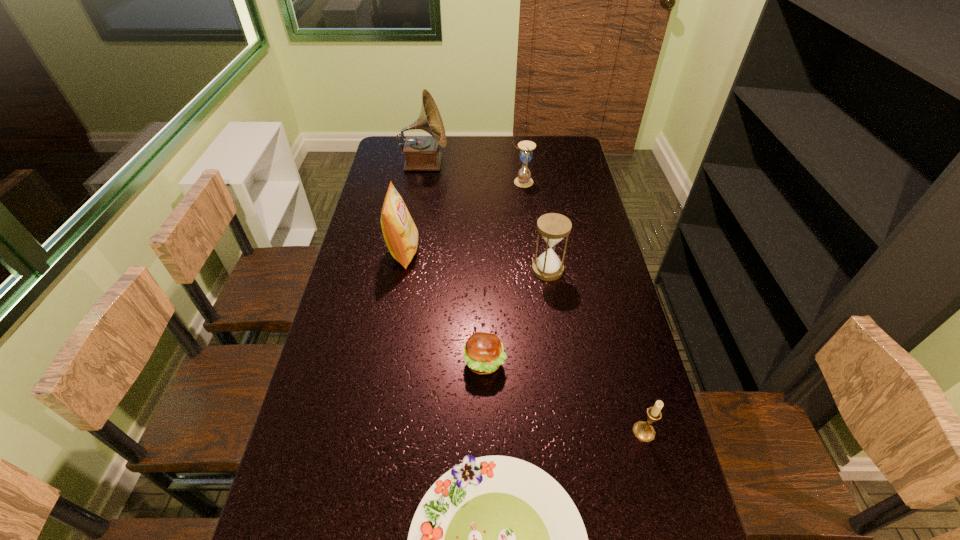
Image resolution: width=960 pixels, height=540 pixels. I want to click on phonograph record, so click(x=421, y=153).

This screenshot has height=540, width=960. Find the location of `the sixth shortest object`. the sixth shortest object is located at coordinates (400, 233).

At what (x,y) coordinates should I click in order to perform the action: click on the nearer hourglass. Please return your answer as a coordinate pair (x, y). The image size is (960, 540). Looking at the image, I should click on (553, 227).

Locate an element on the screen. Image resolution: width=960 pixels, height=540 pixels. the farther hourglass is located at coordinates (524, 179).

The image size is (960, 540). In order to click on candle holder in this screenshot , I will do `click(643, 431)`.

I want to click on the second nearest object, so click(x=643, y=431).

This screenshot has height=540, width=960. I want to click on the second shortest object, so click(x=484, y=353).

You are a GUI agent. You are given a task and a screenshot of the screen. Output one action in this format:
    pyautogui.click(x=<x>, y=<y>)
    Task: Click on the hamburger
    
    Given the screenshot: What is the action you would take?
    pyautogui.click(x=484, y=353)

Locate an element on the screen. This screenshot has width=960, height=540. vacant region located 0.180m on the horn of the tallest object is located at coordinates (490, 164).

Identify the location of free space located on the front-facing side of the crisp (potato chip). The height and width of the screenshot is (540, 960). (516, 252).